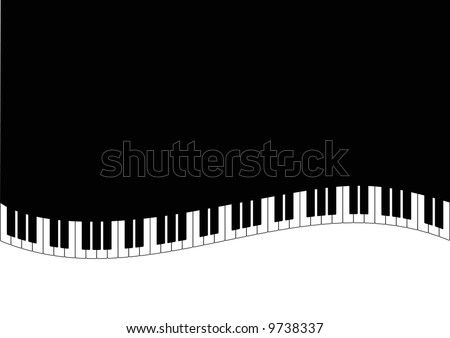
The width and height of the screenshot is (450, 338). Find the location of `space above keyboard`. space above keyboard is located at coordinates (195, 197).